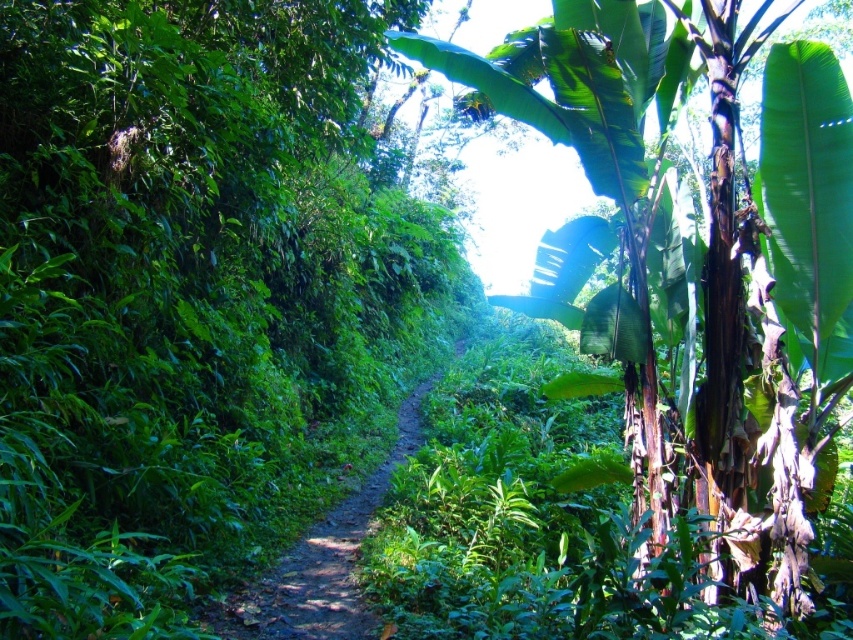
In the scene shown: You are a hiker trying to navigate through the jungle. You see the green leafy banana tree at right and the dirt path at center. Which object takes up more space in the image?

The green leafy banana tree at right has a larger size compared to the dirt path at center, so it takes up more space in the image.

You are navigating a narrow jungle path and see two points marked in the scene. Which point is closer to you, point (x=660, y=84) or point (x=345, y=536)?

Point (x=660, y=84) is closer to the viewer than point (x=345, y=536).